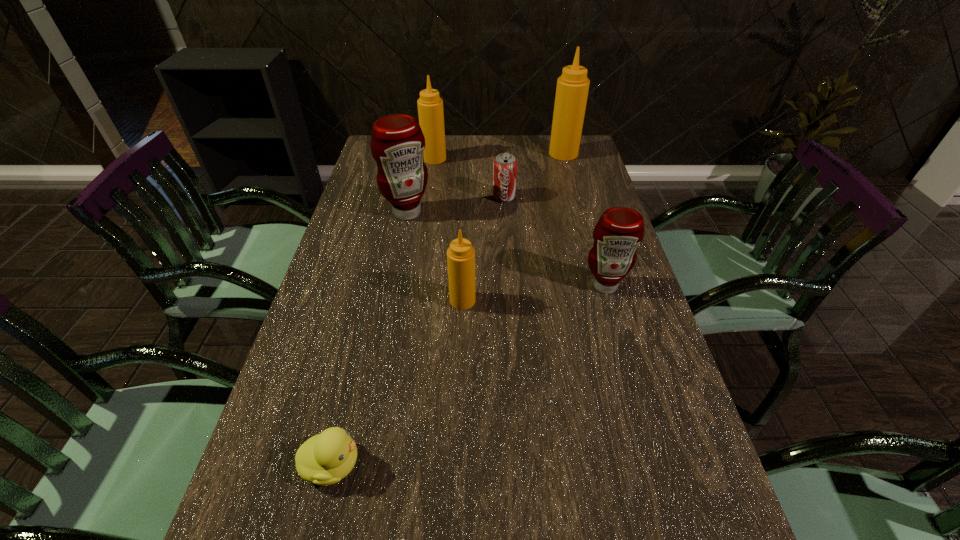
Find the location of a particular element. Image resolution: width=960 pixels, height=540 pixels. free space between the smaller red condiment and the left red condiment is located at coordinates (506, 249).

The image size is (960, 540). Find the location of `free space that is in between the pink soda can and the second smallest tan condiment`. free space that is in between the pink soda can and the second smallest tan condiment is located at coordinates (469, 178).

You are a GUI agent. You are given a task and a screenshot of the screen. Output one action in this format:
    pyautogui.click(x=<x>, y=<y>)
    Task: Click on the free space between the duckling and the tallest condiment
    The width and height of the screenshot is (960, 540).
    Given the screenshot: What is the action you would take?
    pyautogui.click(x=448, y=309)

Find the location of `unoccupied area between the duckling and the pink soda can`. unoccupied area between the duckling and the pink soda can is located at coordinates (419, 330).

Select which object is the closest to the farther red condiment. Please provide its 2D coordinates. Your answer should be formatted as a tuple, i.e. [(x, y)], where the tuple contains the x and y coordinates of a point satisfying the conditions above.

[(505, 165)]

Locate an element on the screen. object that can be found as the third closest to the second biggest tan condiment is located at coordinates (572, 88).

Identify which condiment is located as the fourth nearest to the nearer red condiment. Please provide its 2D coordinates. Your answer should be formatted as a tuple, i.e. [(x, y)], where the tuple contains the x and y coordinates of a point satisfying the conditions above.

[(430, 106)]

Identify the location of condiment identified as the third closest to the tallest condiment. (618, 232).

Where is `tan condiment that stands as the closest to the second tan condiment from left to right`? The height and width of the screenshot is (540, 960). tan condiment that stands as the closest to the second tan condiment from left to right is located at coordinates (430, 106).

Where is `the closest tan condiment to the tallest condiment`? Image resolution: width=960 pixels, height=540 pixels. the closest tan condiment to the tallest condiment is located at coordinates (430, 106).